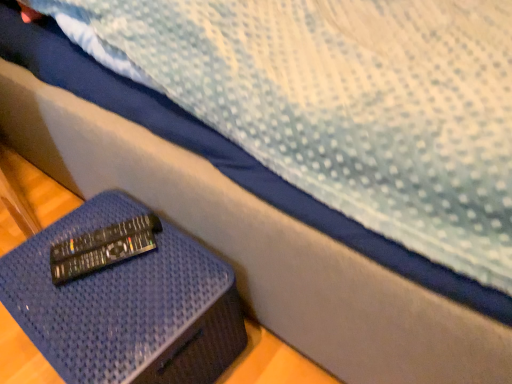
I want to click on vacant space in front of black plastic remote at lower left, acting as the 1th remote starting from the back, so click(x=102, y=311).